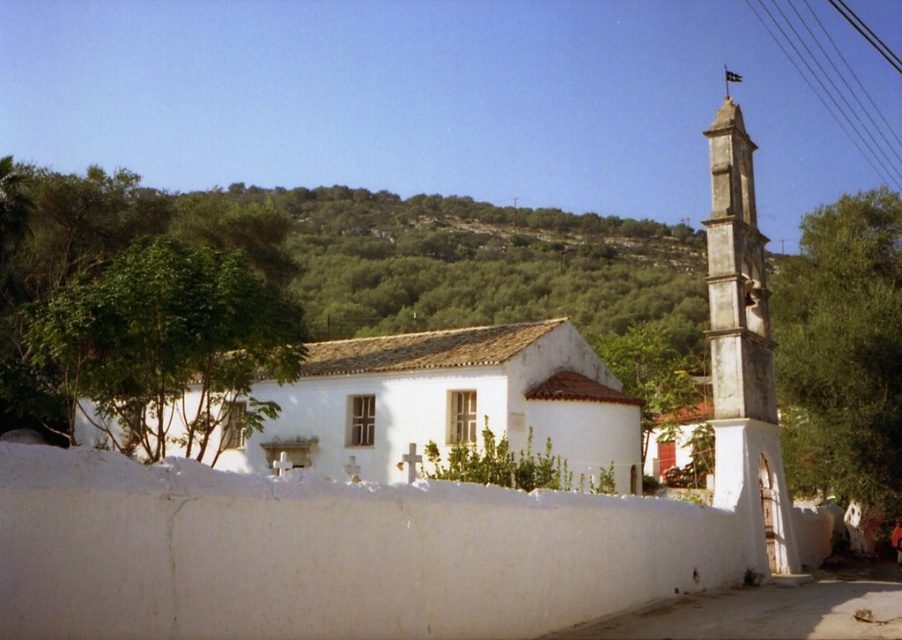
Question: Which object is positioned closest to the white stone tower at right?

Choices:
 (A) green leafy tree at right
 (B) green leafy tree at left
 (C) white matte church at center

Answer: (A)

Question: Among these objects, which one is farthest from the camera?

Choices:
 (A) white matte church at center
 (B) white stone tower at right
 (C) green leafy tree at right
 (D) green leafy tree at left

Answer: (C)

Question: Is white matte church at center thinner than white stone tower at right?

Choices:
 (A) yes
 (B) no

Answer: (A)

Question: Can you confirm if white matte church at center is positioned above green leafy tree at left?

Choices:
 (A) yes
 (B) no

Answer: (B)

Question: Does white matte church at center have a larger size compared to white stone tower at right?

Choices:
 (A) no
 (B) yes

Answer: (A)

Question: Which object is positioned farthest from the green leafy tree at left?

Choices:
 (A) white stone tower at right
 (B) green leafy tree at right
 (C) white matte church at center

Answer: (B)